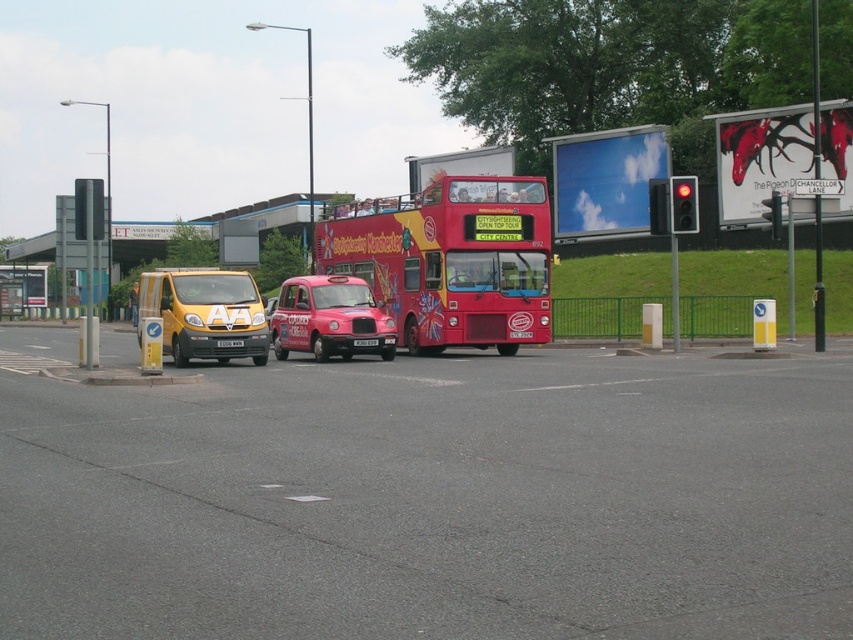
Who is lower down, shiny red double-decker bus at center or yellow matte van at left?

yellow matte van at left is below.

Between point (387, 285) and point (256, 317), which one is positioned in front?

Point (256, 317) is more forward.

In order to click on shiny red double-decker bus at center in this screenshot , I will do `click(451, 260)`.

Who is positioned more to the left, white plastic license plate at center or black plastic license plate at center?

white plastic license plate at center is more to the left.

Can you confirm if white plastic license plate at center is wider than black plastic license plate at center?

Yes.

Measure the distance between white plastic license plate at center and camera.

white plastic license plate at center is 21.77 meters away from camera.

Find the location of a particular element. white plastic license plate at center is located at coordinates (229, 342).

Is point (347, 330) less distant than point (376, 340)?

Yes, point (347, 330) is in front of point (376, 340).

Who is higher up, matte red taxi at center or black plastic license plate at center?

Positioned higher is matte red taxi at center.

Between point (363, 346) and point (370, 344), which one is positioned in front?

Point (363, 346) is in front.

The image size is (853, 640). Find the location of `matte red taxi at center`. matte red taxi at center is located at coordinates (329, 317).